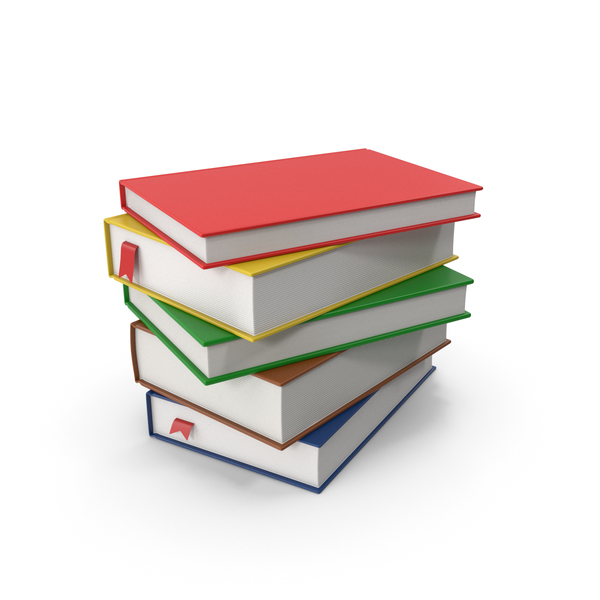
At what (x,y) coordinates should I click in order to perform the action: click on thick books. Please return your answer as a coordinate pair (x, y). This screenshot has height=600, width=600. Looking at the image, I should click on (294, 293), (311, 405), (291, 468).